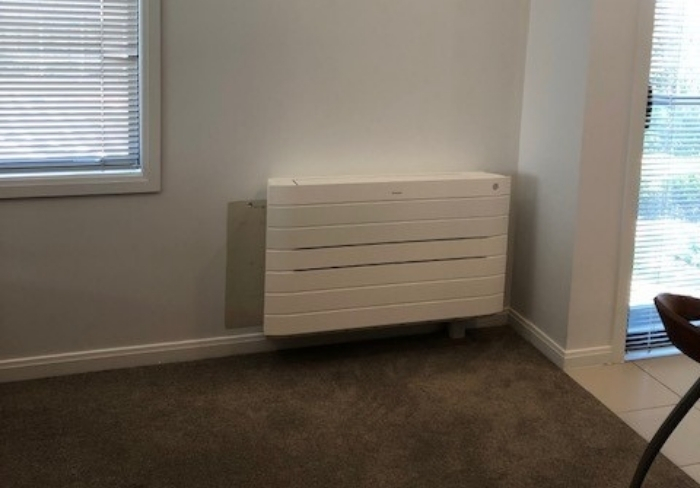
At what (x,y) coordinates should I click in order to perform the action: click on chair/table leg. Please return your answer as a coordinate pair (x, y). The height and width of the screenshot is (488, 700). Looking at the image, I should click on (663, 432).